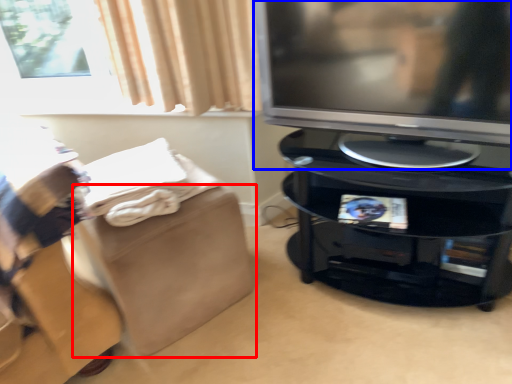
Question: Which object appears closest to the camera in this image, footrest (highlighted by a red box) or television (highlighted by a blue box)?

Choices:
 (A) footrest
 (B) television

Answer: (B)